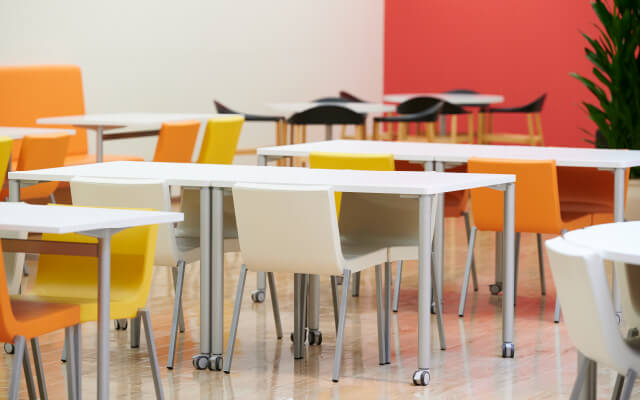
The height and width of the screenshot is (400, 640). Identify the location of tables. (356, 106), (397, 94), (131, 120), (29, 134), (105, 166), (74, 221), (476, 148), (614, 245).